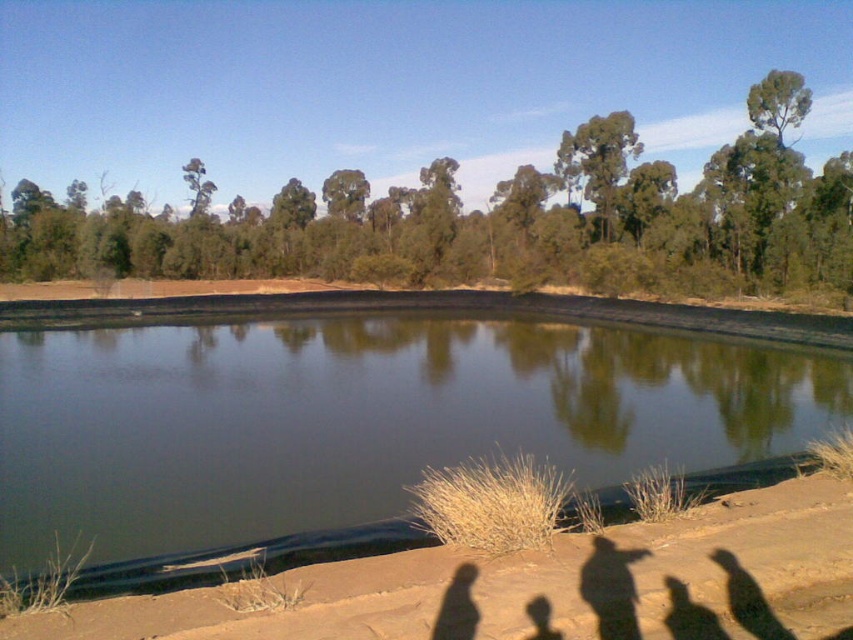
Question: Observing the image, what is the correct spatial positioning of greenish-brown water at center in reference to brown sandy shore at lower center?

Choices:
 (A) above
 (B) below

Answer: (A)

Question: Among these objects, which one is farthest from the camera?

Choices:
 (A) greenish-brown water at center
 (B) brown sandy shore at lower center

Answer: (A)

Question: Which point is farther to the camera?

Choices:
 (A) (601, 636)
 (B) (16, 497)

Answer: (B)

Question: Is greenish-brown water at center to the right of brown sandy shore at lower center from the viewer's perspective?

Choices:
 (A) yes
 (B) no

Answer: (B)

Question: Which object is farther from the camera taking this photo?

Choices:
 (A) brown sandy shore at lower center
 (B) greenish-brown water at center

Answer: (B)

Question: Does greenish-brown water at center have a larger size compared to brown sandy shore at lower center?

Choices:
 (A) yes
 (B) no

Answer: (A)